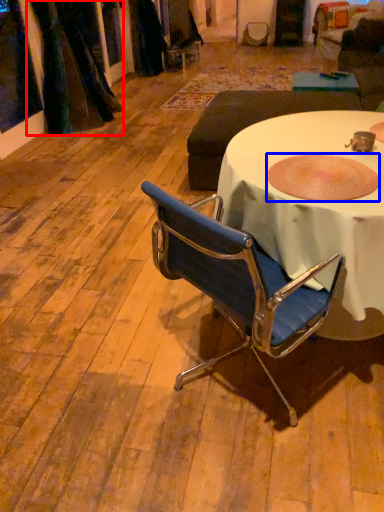
Question: Which of the following is the closest to the observer, curtain (highlighted by a red box) or bowl (highlighted by a blue box)?

Choices:
 (A) curtain
 (B) bowl

Answer: (B)